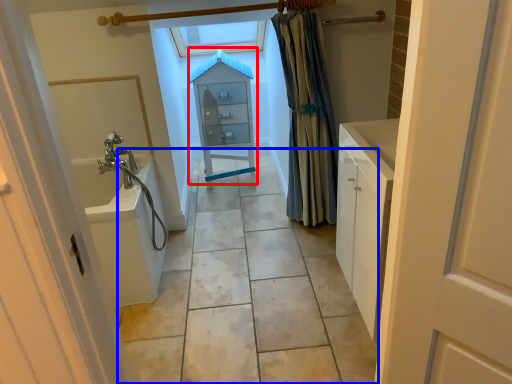
Question: Which point is further to the camera, medicine cabinet (highlighted by a red box) or path (highlighted by a blue box)?

Choices:
 (A) medicine cabinet
 (B) path

Answer: (A)